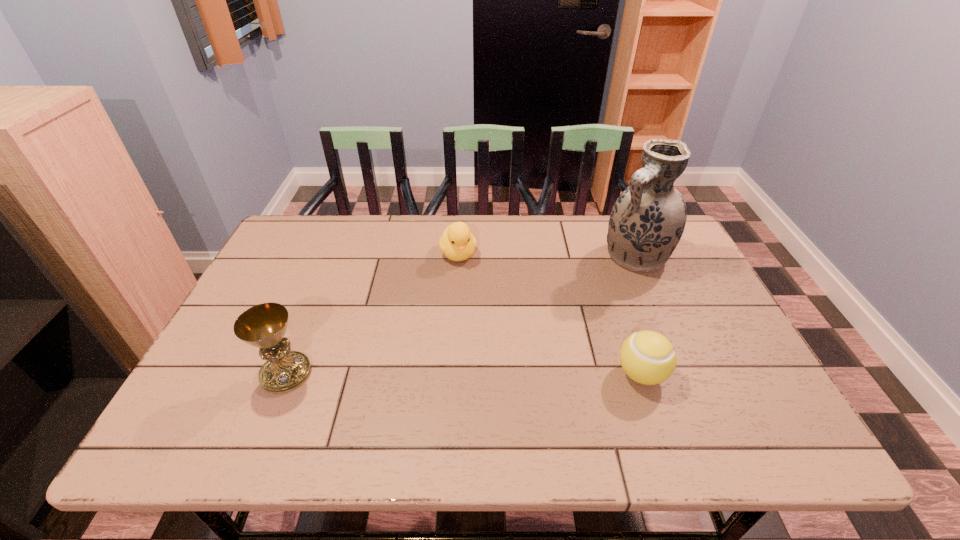
Where is `free space between the third shortest object and the tallest object`? The height and width of the screenshot is (540, 960). free space between the third shortest object and the tallest object is located at coordinates (462, 315).

This screenshot has height=540, width=960. Find the location of `vacant area between the chalice and the tennis ball`. vacant area between the chalice and the tennis ball is located at coordinates (464, 374).

The height and width of the screenshot is (540, 960). I want to click on free spot between the tennis ball and the duck, so click(550, 314).

The image size is (960, 540). Find the location of `free point between the duck and the tallest object`. free point between the duck and the tallest object is located at coordinates (547, 255).

This screenshot has height=540, width=960. Find the location of `free space between the tallest object and the tennis ball`. free space between the tallest object and the tennis ball is located at coordinates (639, 315).

Where is `free area in between the chalice and the vase`? The width and height of the screenshot is (960, 540). free area in between the chalice and the vase is located at coordinates (462, 315).

Select which object is the third closest to the vase. Please provide its 2D coordinates. Your answer should be formatted as a tuple, i.e. [(x, y)], where the tuple contains the x and y coordinates of a point satisfying the conditions above.

[(264, 325)]

At what (x,y) coordinates should I click in order to perform the action: click on object that stands as the second closest to the tallest object. Please return your answer as a coordinate pair (x, y). The width and height of the screenshot is (960, 540). Looking at the image, I should click on (457, 243).

The image size is (960, 540). Identify the location of blank space that satisfies the following two spatial constraints: 1. on the back side of the vase; 2. on the left side of the tennis ball. (602, 256).